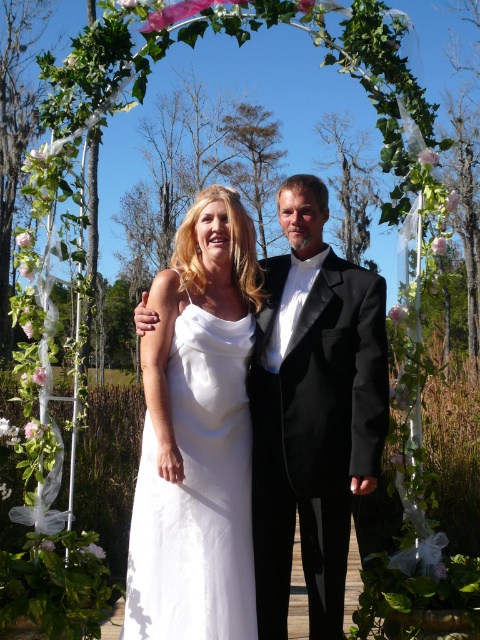
You are a photographer at a wedding. You need to place a bouquet at a specific point to avoid blocking the floral archway. The coordinates of the point are given as point (196, 435). What object is located at that point?

The white satin dress at center is located at point (196, 435).